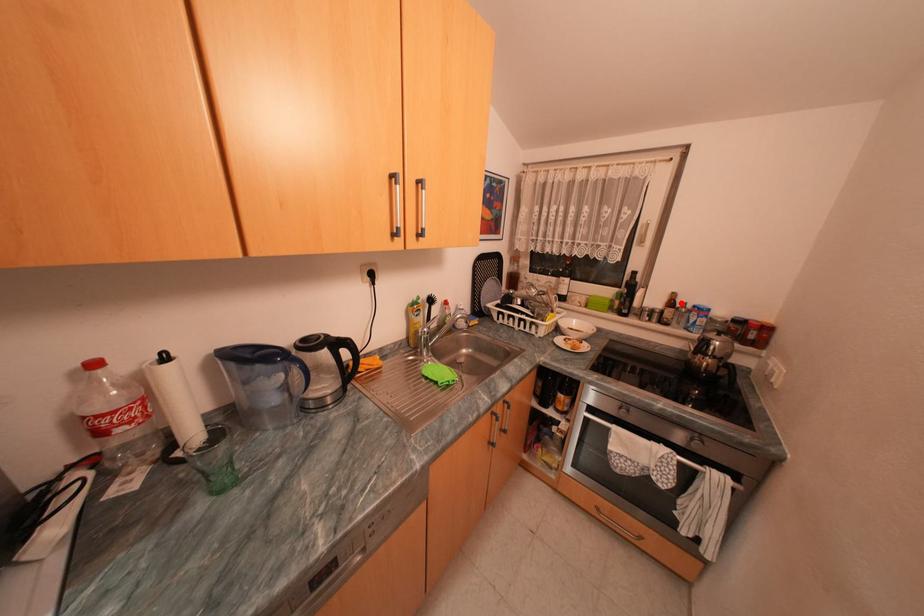
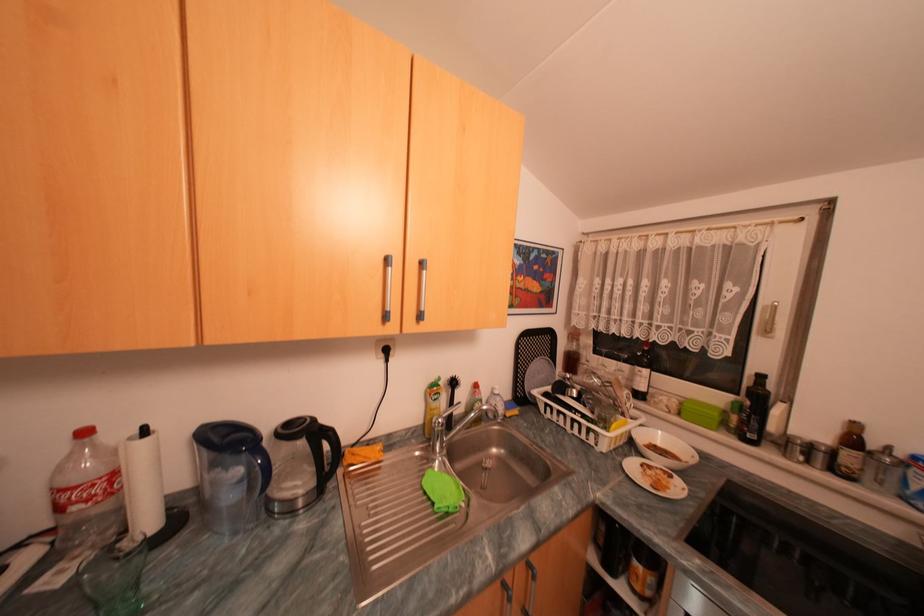
In the second image, find the point that corresponds to the highlighted location in the first image.

(862, 440)